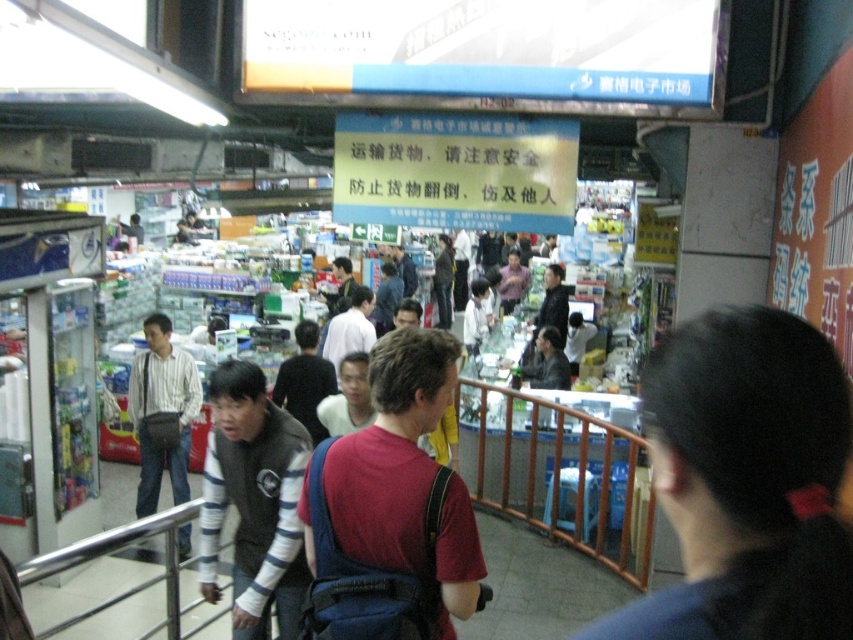
Is point (254, 605) behind point (167, 340)?

No.

Which of these two, striped sweater at center or striped cotton shirt at left, stands taller?

striped cotton shirt at left

Between point (229, 384) and point (144, 356), which one is positioned behind?

The point (144, 356) is more distant.

Where is `striped sweater at center`? This screenshot has width=853, height=640. striped sweater at center is located at coordinates (253, 500).

Does brown wooden rail at center have a lesser height compared to striped sweater at center?

No.

Is point (523, 394) in front of point (241, 465)?

No, (523, 394) is further to viewer.

Find the location of a particular element. brown wooden rail at center is located at coordinates (560, 474).

Does dark brown hair at center have a smaller size compared to brown wooden rail at center?

Indeed, dark brown hair at center has a smaller size compared to brown wooden rail at center.

At what (x,y) coordinates should I click in order to perform the action: click on dark brown hair at center. Please return your answer as a coordinate pair (x, y). The width and height of the screenshot is (853, 640). Looking at the image, I should click on coord(746,481).

The height and width of the screenshot is (640, 853). Identify the location of dark brown hair at center. (746, 481).